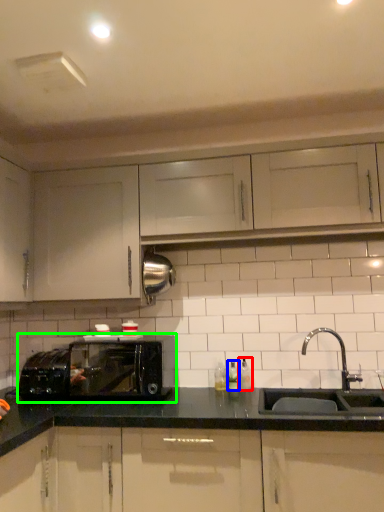
Question: Which is nearer to the bottle (highlighted by a red box)? bottle (highlighted by a blue box) or microwave oven (highlighted by a green box).

Choices:
 (A) bottle
 (B) microwave oven

Answer: (A)